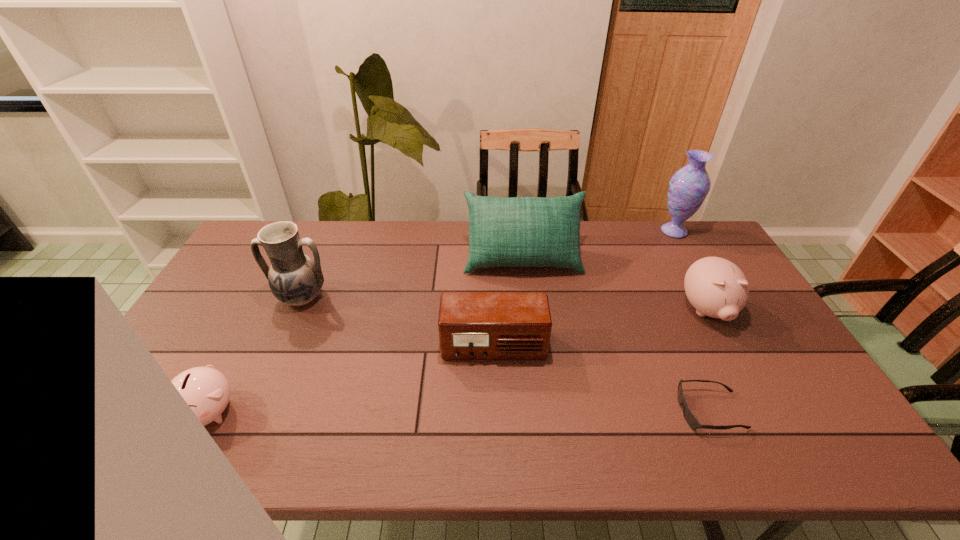
Select which object is the third closest to the right piggy bank. Please provide its 2D coordinates. Your answer should be formatted as a tuple, i.e. [(x, y)], where the tuple contains the x and y coordinates of a point satisfying the conditions above.

[(519, 231)]

Identify the location of object that is the fourth closest to the nearer piggy bank. (689, 417).

The height and width of the screenshot is (540, 960). Find the location of `free spot that satisfies the following two spatial constraints: 1. on the front-facing side of the shortest object; 2. on the front side of the left piggy bank`. free spot that satisfies the following two spatial constraints: 1. on the front-facing side of the shortest object; 2. on the front side of the left piggy bank is located at coordinates (710, 411).